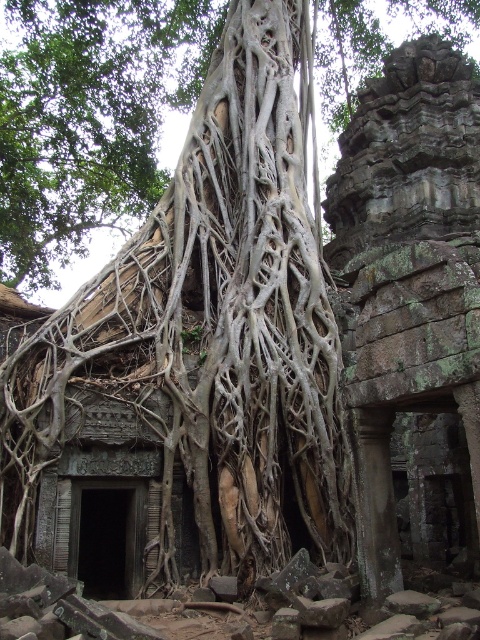
Question: Which of the following is the closest to the observer?

Choices:
 (A) (333, 51)
 (B) (269, 288)

Answer: (B)

Question: Does gray textured roots at center have a larger size compared to white textured roots at center?

Choices:
 (A) yes
 (B) no

Answer: (B)

Question: Does gray textured roots at center appear over white textured roots at center?

Choices:
 (A) yes
 (B) no

Answer: (B)

Question: Is gray textured roots at center below white textured roots at center?

Choices:
 (A) yes
 (B) no

Answer: (A)

Question: Among these points, which one is farthest from the camera?

Choices:
 (A) (70, 182)
 (B) (163, 344)

Answer: (A)